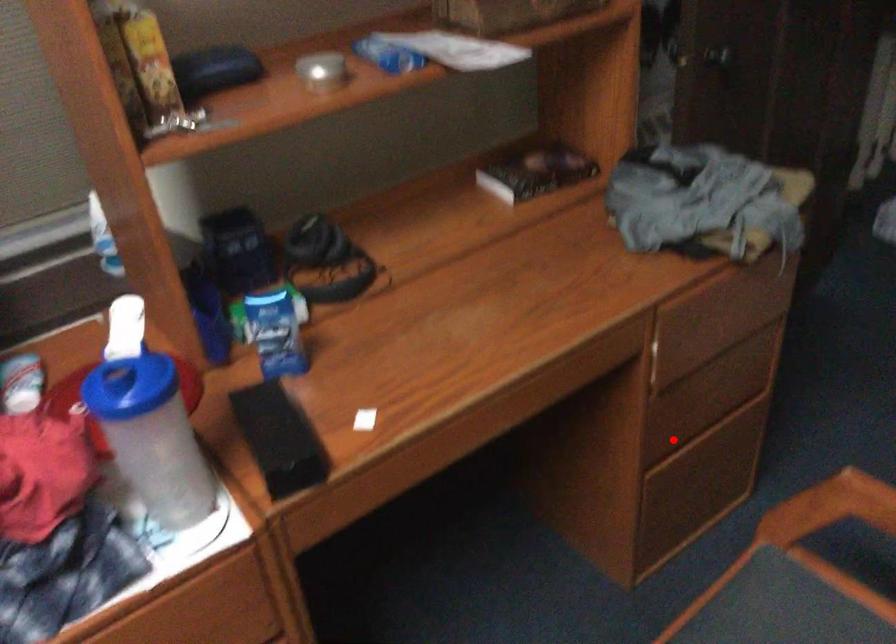
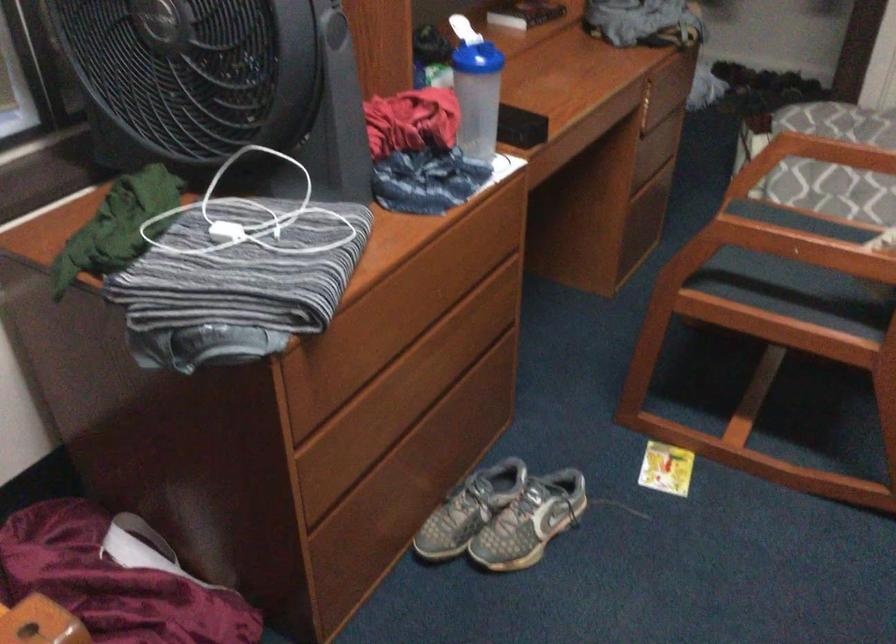
Question: I am providing you with two images of the same scene from different viewpoints. Given a red point in image1, look at the same physical point in image2. Is it:

Choices:
 (A) Closer to the viewpoint
 (B) Farther from the viewpoint

Answer: (B)